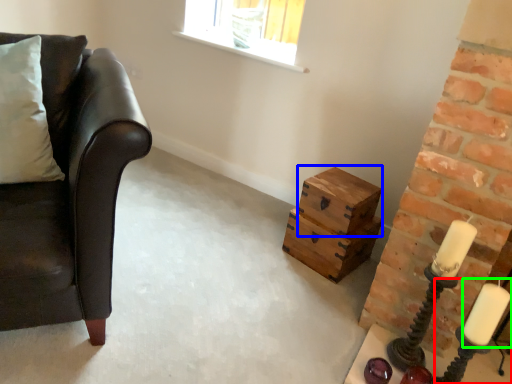
Question: Based on their relative distances, which object is farther from candle holder (highlighted by a red box)? Choose from box (highlighted by a blue box) and candle (highlighted by a green box).

Choices:
 (A) box
 (B) candle

Answer: (A)